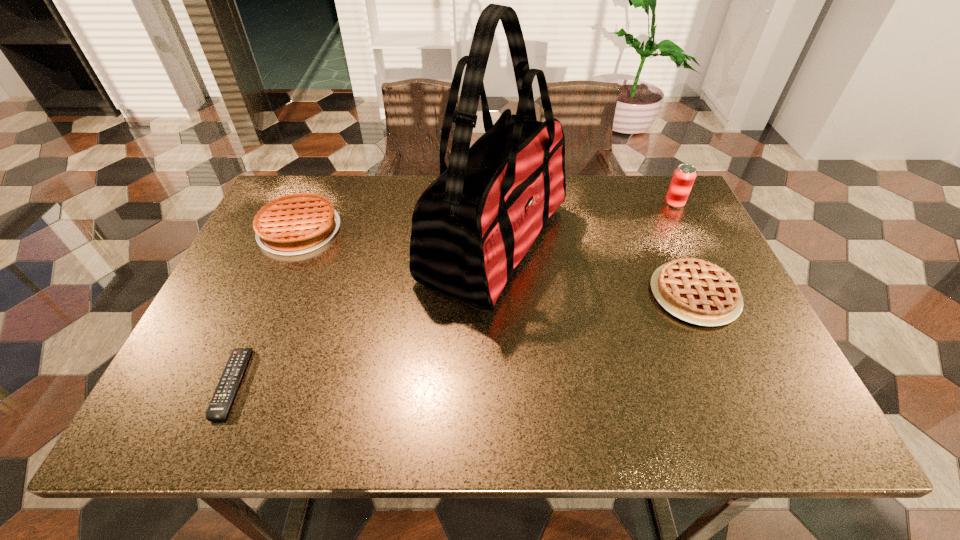
What are the coordinates of `vacant space situated on the left of the second tallest object` in the screenshot? It's located at (593, 203).

This screenshot has width=960, height=540. I want to click on vacant area situated 0.390m on the front of the farther pie, so pos(228,394).

This screenshot has height=540, width=960. I want to click on free space located on the left of the right pie, so click(571, 294).

The image size is (960, 540). In order to click on vacant space situated 0.240m on the right of the remote control in this screenshot , I will do `click(363, 383)`.

The height and width of the screenshot is (540, 960). Identify the location of duffel bag at the far edge. (471, 227).

The image size is (960, 540). Find the location of `beer can located in the far edge section of the desktop`. beer can located in the far edge section of the desktop is located at coordinates (684, 176).

Identify the location of pie at the far edge. This screenshot has height=540, width=960. (298, 223).

This screenshot has width=960, height=540. I want to click on object at the near edge, so click(218, 408).

Image resolution: width=960 pixels, height=540 pixels. I want to click on pie that is at the left edge, so click(298, 223).

Locate an element on the screen. The width and height of the screenshot is (960, 540). remote control at the left edge is located at coordinates (218, 408).